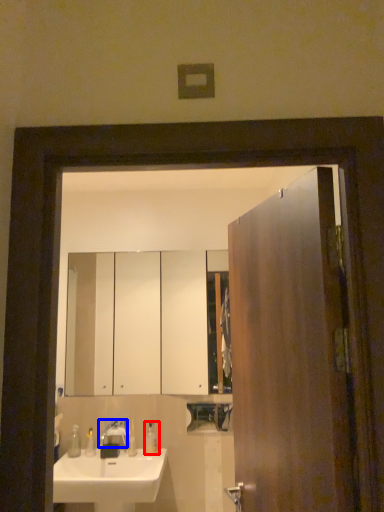
Question: Which object is further to the camera taking this photo, soap dispenser (highlighted by a red box) or tap (highlighted by a blue box)?

Choices:
 (A) soap dispenser
 (B) tap

Answer: (A)